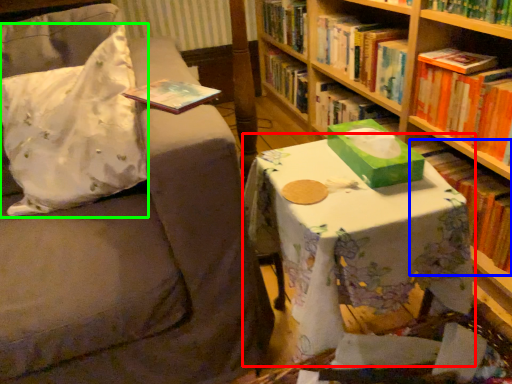
Question: Which object is positioned farthest from table (highlighted by a red box)? Select from book (highlighted by a blue box) and throw pillow (highlighted by a green box).

Choices:
 (A) book
 (B) throw pillow

Answer: (A)